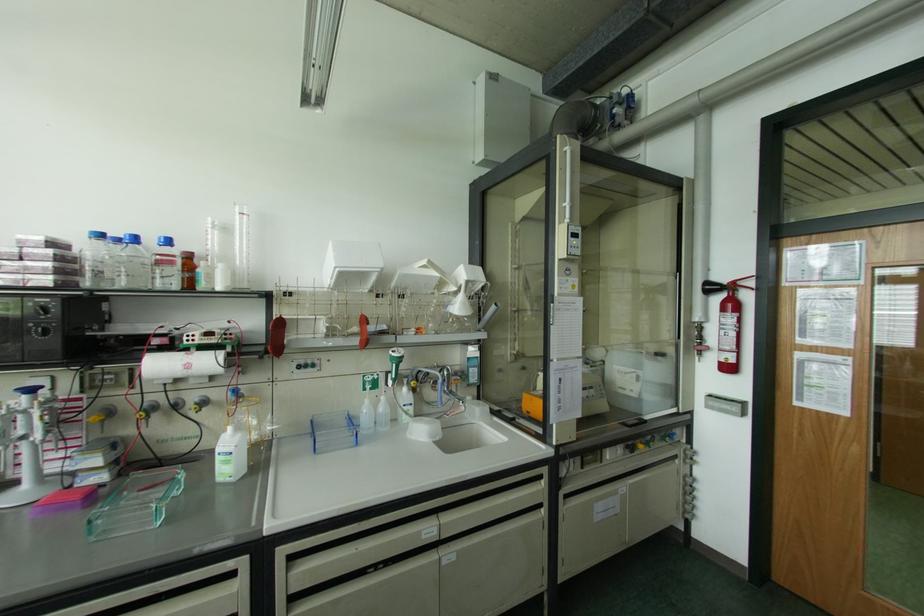
Find the location of a particular element. This screenshot has width=924, height=616. silver faucet handle is located at coordinates (451, 400).